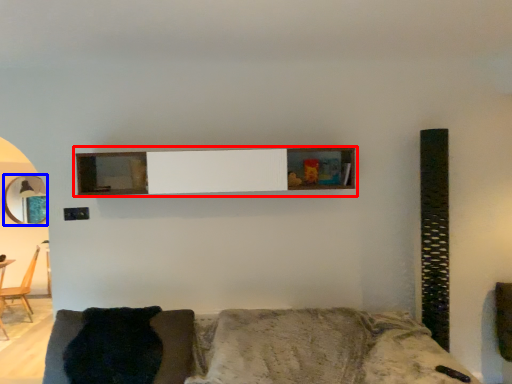
Question: Which of the following is the closest to the observer, shelf (highlighted by a red box) or mirror (highlighted by a blue box)?

Choices:
 (A) shelf
 (B) mirror

Answer: (A)